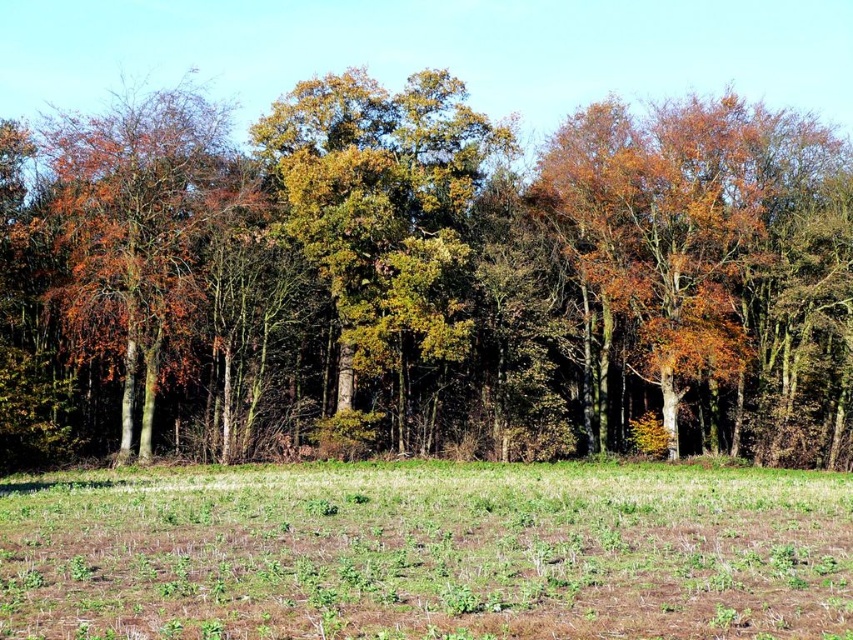
You are standing at the origin point of the image. Which direction should you walk to reach the green leafy trees at center?

The green leafy trees at center are located at coordinate point (426, 278), so you should walk towards the center of the image to reach them.

You are standing in the field and looking towards the forest. You see the green grass at lower center and the green leafy tree at center. Which object is closer to you?

The green grass at lower center is closer to you because it is positioned under the green leafy tree at center, indicating it is in the foreground.